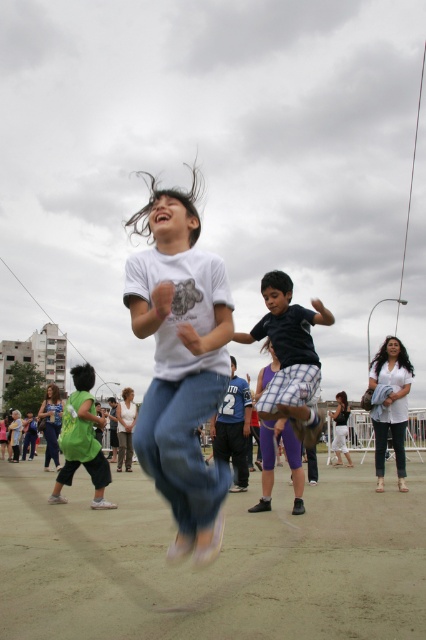
You are organizing a photo shoot and need to position two models wearing the green fabric shirt at lower left and white cotton shirt at lower right. Based on the scene, which shirt is positioned lower in the image?

The green fabric shirt at lower left is located below the white cotton shirt at lower right, so the green fabric shirt at lower left is positioned lower in the image.

You are a photographer at this event and want to capture a closeup of the black cotton shirt at center. Based on its coordinates, where should you aim your camera?

The black cotton shirt at center is located at coordinates point (290, 355), so aim your camera there.